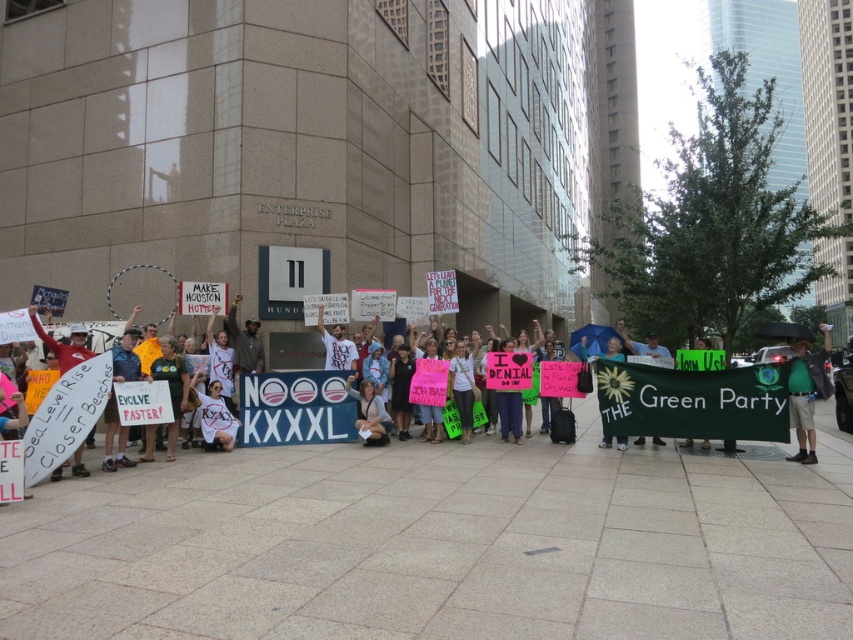
Based on the scene description, where is the white paper sign at left located in the image?

The white paper sign at left is located at point (62, 342) in the image.

You are a photographer at the protest scene. You need to capture a photo that includes both the green fabric shirt at center and the white paper sign at left. Based on their positions, which object should appear on the left side of the photo?

The white paper sign at left should appear on the left side of the photo because the green fabric shirt at center is to the right of it.